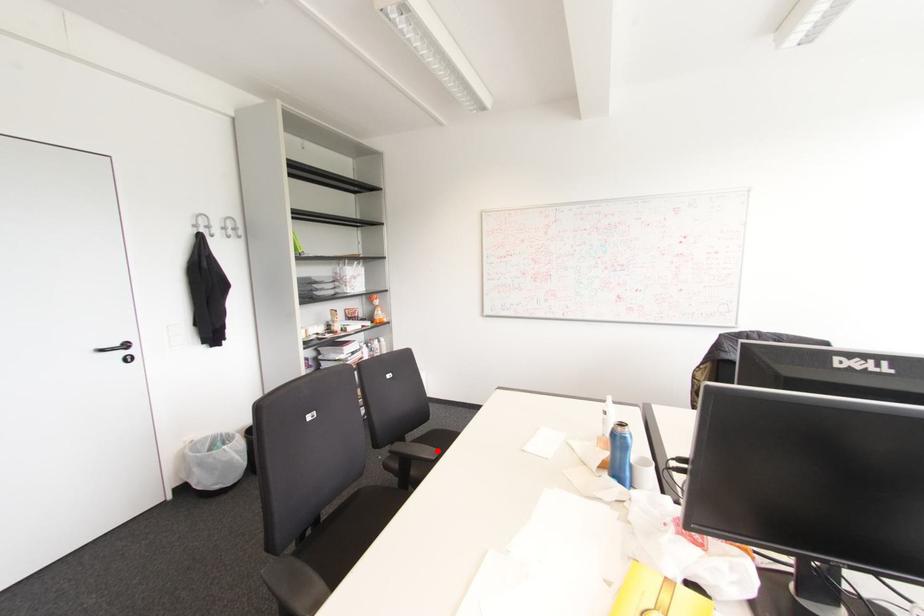
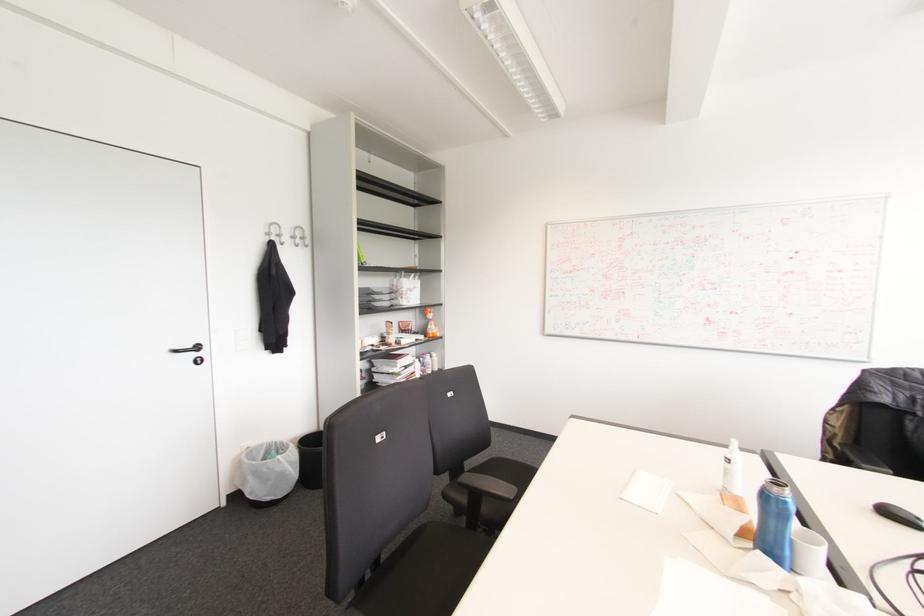
Question: I am providing you with two images of the same scene from different viewpoints. Image1 has a red point marked. In image2, the corresponding 3D location appears at what relative position? Reply with the corresponding letter.

Choices:
 (A) Closer
 (B) Farther

Answer: (B)